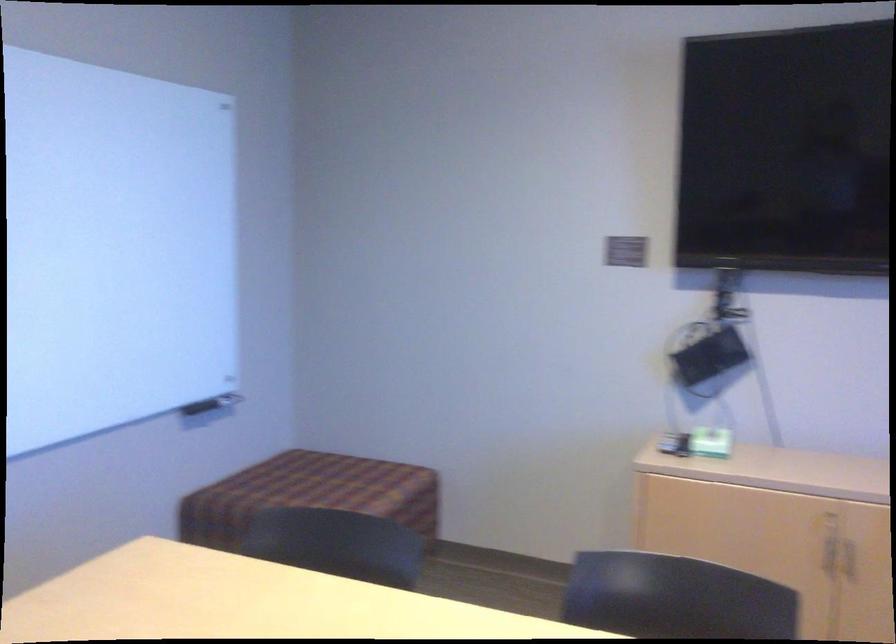
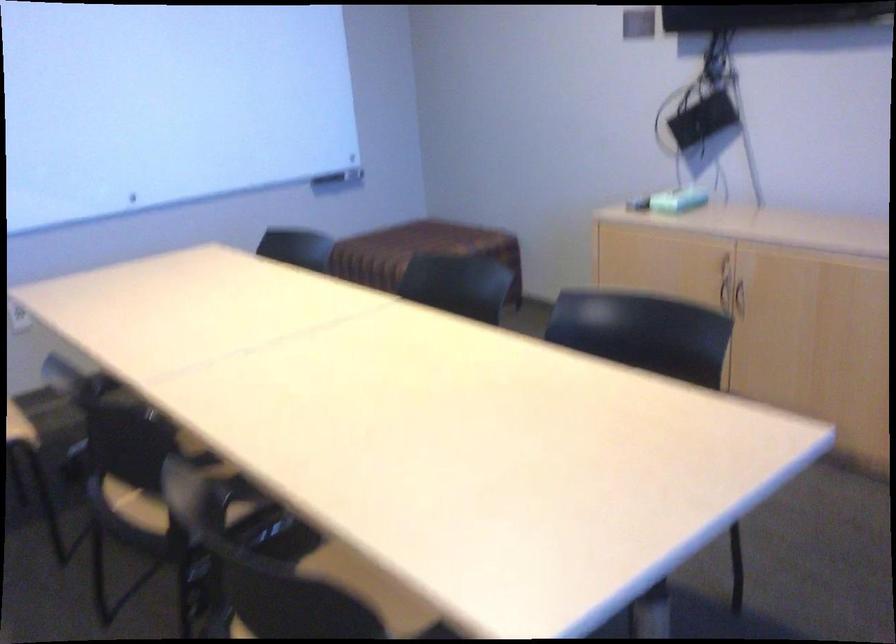
The point at [220,409] is marked in the first image. Where is the corresponding point in the second image?

(339, 178)